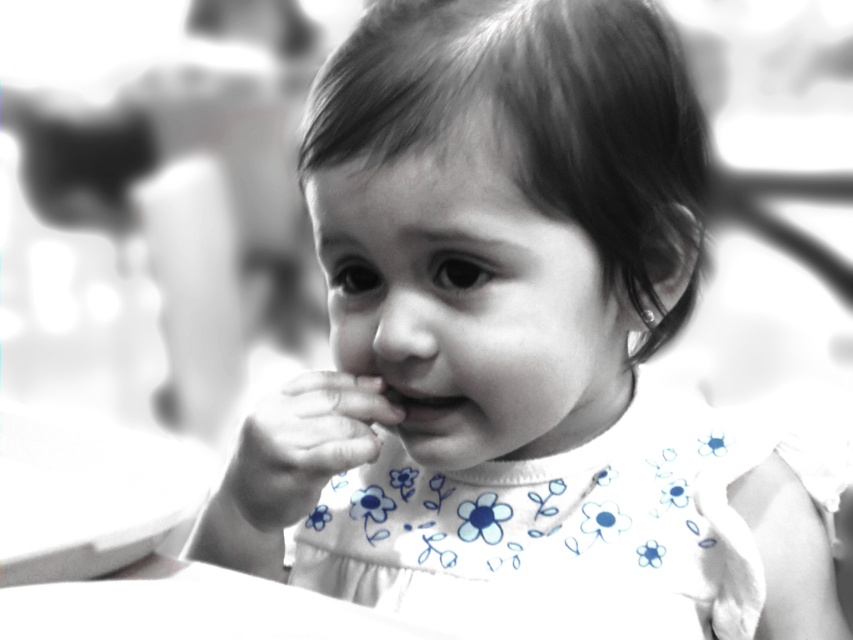
Question: Which point is farther from the camera taking this photo?

Choices:
 (A) (262, 400)
 (B) (393, 397)

Answer: (B)

Question: Among these objects, which one is farthest from the camera?

Choices:
 (A) smooth skin hand at center
 (B) smooth skin mouth at center

Answer: (B)

Question: Can you confirm if smooth skin hand at center is positioned to the right of smooth skin mouth at center?

Choices:
 (A) no
 (B) yes

Answer: (A)

Question: Is smooth skin hand at center positioned at the back of smooth skin mouth at center?

Choices:
 (A) yes
 (B) no

Answer: (B)

Question: Is smooth skin hand at center bigger than smooth skin mouth at center?

Choices:
 (A) yes
 (B) no

Answer: (A)